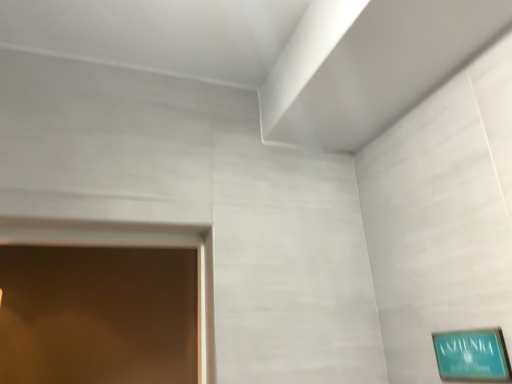
The image size is (512, 384). Describe the element at coordinates (472, 355) in the screenshot. I see `teal matte sign at lower right` at that location.

Find the location of a particular element. This screenshot has width=512, height=384. teal matte sign at lower right is located at coordinates (472, 355).

Where is `teal matte sign at lower right`? The width and height of the screenshot is (512, 384). teal matte sign at lower right is located at coordinates (472, 355).